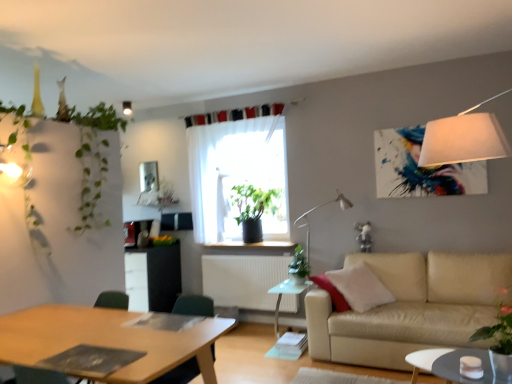
Where is `free point above white matte radiator at center (from a real-world perspective)`? The height and width of the screenshot is (384, 512). free point above white matte radiator at center (from a real-world perspective) is located at coordinates (252, 253).